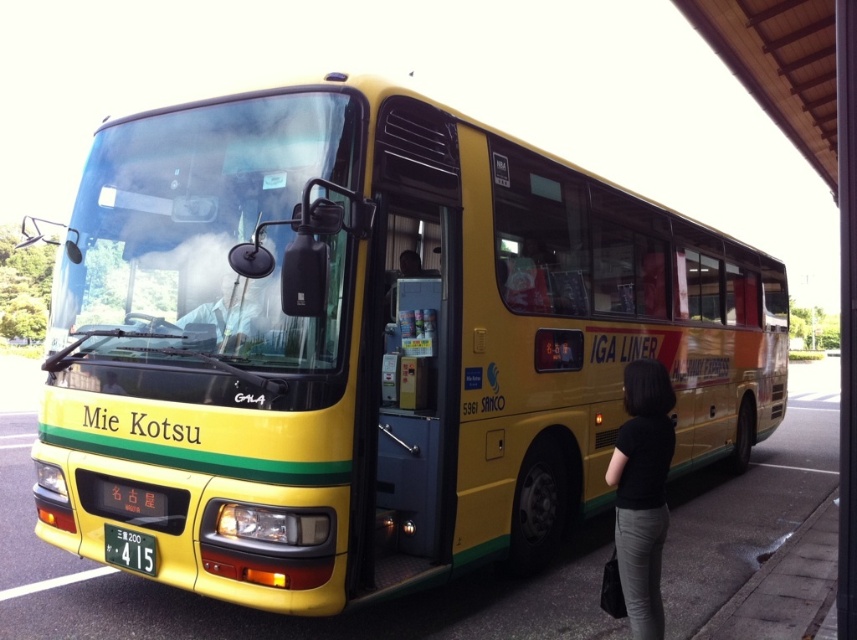
Question: Considering the relative positions of black fabric at lower right and yellow plastic license plate at lower center in the image provided, where is black fabric at lower right located with respect to yellow plastic license plate at lower center?

Choices:
 (A) above
 (B) below

Answer: (A)

Question: Among these points, which one is farthest from the camera?

Choices:
 (A) (670, 440)
 (B) (130, 554)

Answer: (B)

Question: Is black fabric at lower right further to camera compared to yellow plastic license plate at lower center?

Choices:
 (A) yes
 (B) no

Answer: (B)

Question: Which of the following is the closest to the observer?

Choices:
 (A) yellow plastic license plate at lower center
 (B) black fabric at lower right

Answer: (B)

Question: Can you confirm if black fabric at lower right is bigger than yellow plastic license plate at lower center?

Choices:
 (A) yes
 (B) no

Answer: (A)